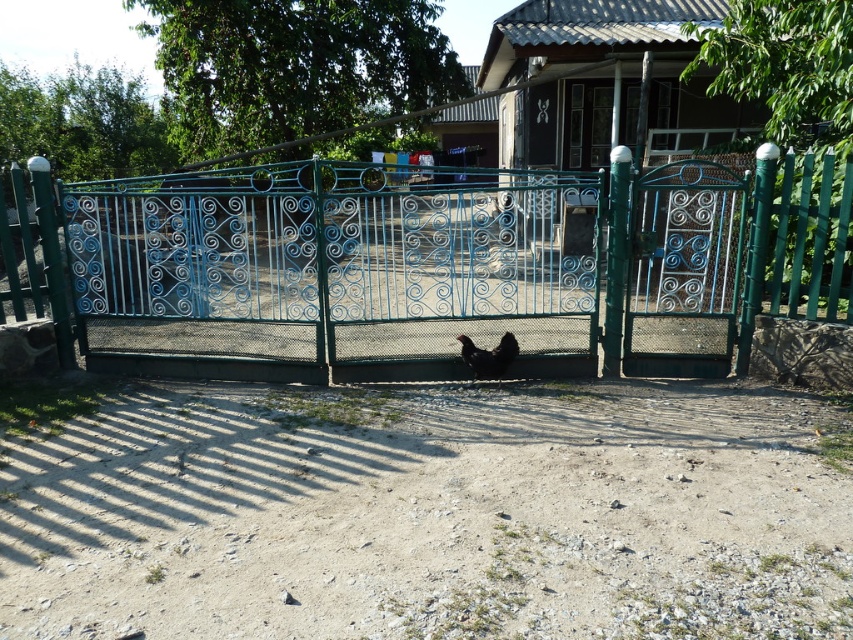
You are standing at the entrance of the rural scene and want to locate a specific point marked as point (451, 266). According to the image, where exactly is this point located?

The point (451, 266) is located on the green wrought iron gate at center.

Consider the image. You are standing at the entrance of the gate and want to walk towards the house. There are two points marked on the ground ahead of you. The first point is at coordinates point (x=476, y=211) and the second is at point (x=474, y=348). Which point should you step on first to stay on the path leading to the house?

Point (x=476, y=211) is in front of point (x=474, y=348), so you should step on point (x=476, y=211) first to stay on the path leading to the house.

You are standing in front of the green wrought iron gate at center and want to reach the black matte chicken at center. Which direction should you move to get closer to the chicken?

Since the green wrought iron gate at center is closer to the viewer than the black matte chicken at center, you should move forward towards the chicken to get closer to it.